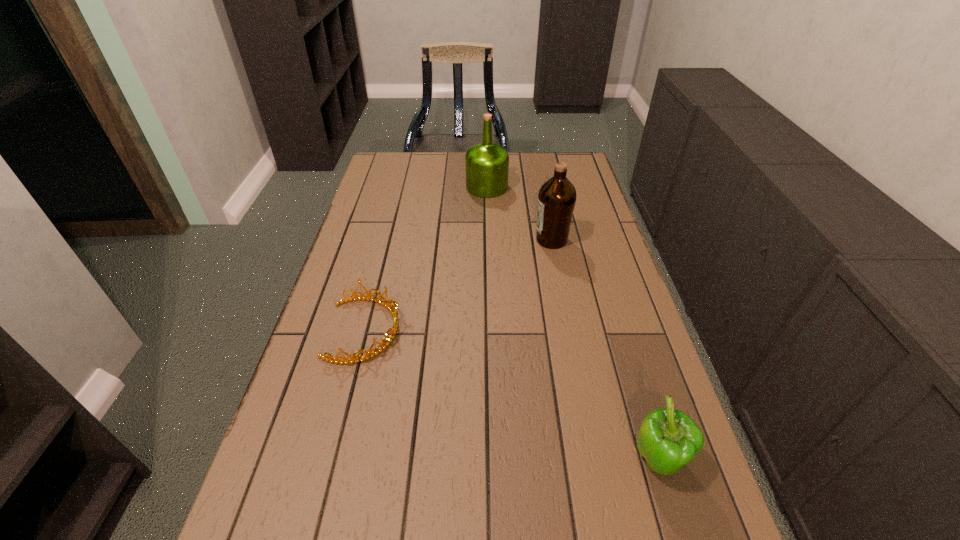
Identify the location of free space that satisfies the following two spatial constraints: 1. on the front-facing side of the leftmost object; 2. on the back side of the rightmost object. (331, 462).

This screenshot has width=960, height=540. In order to click on vacant point that satisfies the following two spatial constraints: 1. on the label of the right olive oil; 2. on the right side of the nearest object in this screenshot , I will do coord(595,462).

The width and height of the screenshot is (960, 540). I want to click on vacant area that satisfies the following two spatial constraints: 1. on the front-facing side of the leftmost object; 2. on the right side of the third tallest object, so click(331, 462).

At what (x,y) coordinates should I click in order to perform the action: click on free spot that satisfies the following two spatial constraints: 1. on the label of the nearer olive oil; 2. on the right side of the nearest object. Please return your answer as a coordinate pair (x, y). The width and height of the screenshot is (960, 540). Looking at the image, I should click on (595, 462).